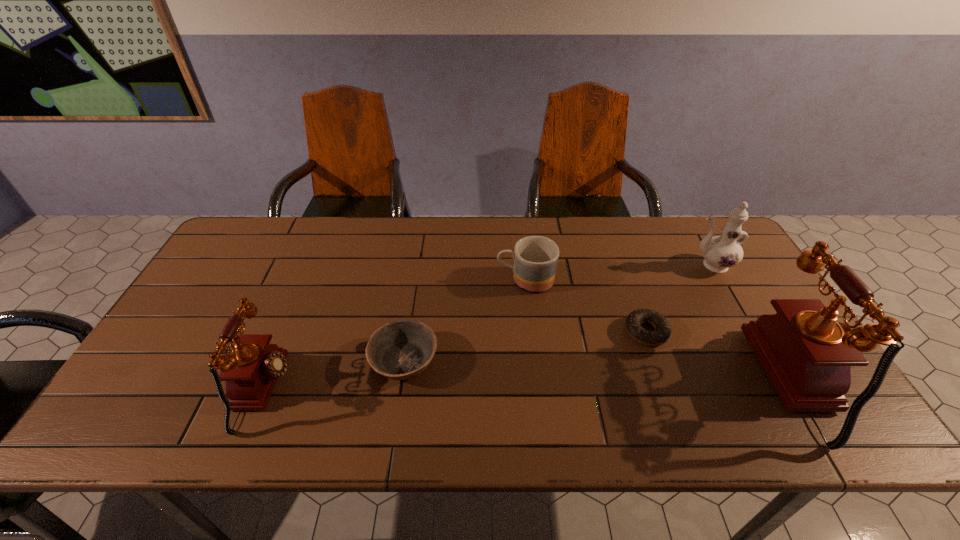
In order to click on free point between the third shortest object and the chinaware in this screenshot , I will do `click(618, 273)`.

What are the coordinates of `free space that is in between the leftmost object and the chinaware` in the screenshot? It's located at (487, 328).

At what (x,y) coordinates should I click in order to perform the action: click on unoccupied position between the bowl and the taller telephone. Please return your answer as a coordinate pair (x, y). This screenshot has width=960, height=540. Looking at the image, I should click on (605, 372).

Locate an element on the screen. vacant area between the fourth object from right to left and the fifth object from right to left is located at coordinates (465, 321).

Locate an element on the screen. This screenshot has height=540, width=960. vacant space that is in between the fifth object from right to left and the doughnut is located at coordinates (525, 347).

At what (x,y) coordinates should I click in order to perform the action: click on unoccupied position between the fourth object from right to left and the fifth tallest object. Please return your answer as a coordinate pair (x, y). Looking at the image, I should click on click(x=465, y=321).

You are a GUI agent. You are given a task and a screenshot of the screen. Output one action in this format:
    pyautogui.click(x=<x>, y=<y>)
    Task: Click on the empty space that is in between the fifth object from right to left and the third object from left to right
    
    Given the screenshot: What is the action you would take?
    pyautogui.click(x=465, y=321)

Where is `free space between the chinaware and the fifth tallest object`? The image size is (960, 540). free space between the chinaware and the fifth tallest object is located at coordinates (558, 313).

Find the location of a particular element. free point between the left telephone and the shortest object is located at coordinates (455, 361).

Select which object appears as the second closest to the chinaware. Please provide its 2D coordinates. Your answer should be formatted as a tuple, i.e. [(x, y)], where the tuple contains the x and y coordinates of a point satisfying the conditions above.

[(633, 322)]